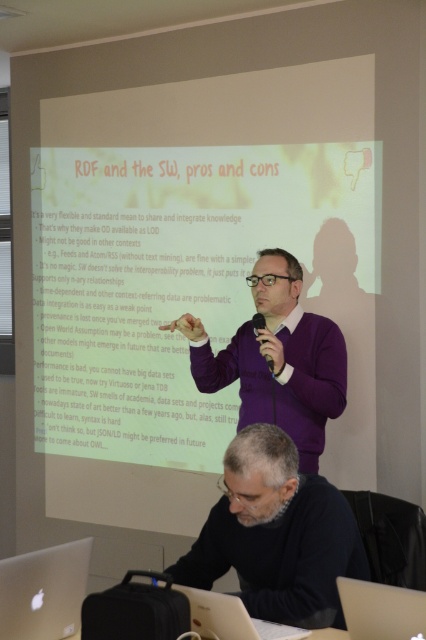
Between silver metallic laptop at lower left and silver metallic laptop at lower right, which one is positioned higher?

Positioned higher is silver metallic laptop at lower right.

Is silver metallic laptop at lower left bigger than silver metallic laptop at lower right?

Yes.

Which is behind, point (86, 538) or point (394, 636)?

Point (86, 538)

Where is `silver metallic laptop at lower left`? This screenshot has width=426, height=640. silver metallic laptop at lower left is located at coordinates (43, 592).

Which is in front, point (100, 294) or point (302, 560)?

Point (302, 560) is in front.

In the scene shown: Can you confirm if white matte projection screen at upper center is positioned above gray sweater at lower center?

Yes, white matte projection screen at upper center is above gray sweater at lower center.

At what (x,y) coordinates should I click in order to perform the action: click on white matte projection screen at upper center. Please return your answer as a coordinate pair (x, y). The width and height of the screenshot is (426, 640). Looking at the image, I should click on (178, 280).

Measure the distance between point [345,250] and camera.

Point [345,250] is 3.21 meters away from camera.

Can you confirm if white matte projection screen at upper center is positioned below silver metallic laptop at lower left?

No, white matte projection screen at upper center is not below silver metallic laptop at lower left.

Is point (210, 312) in front of point (74, 595)?

No, it is not.

Where is `white matte projection screen at upper center`? The width and height of the screenshot is (426, 640). white matte projection screen at upper center is located at coordinates (178, 280).